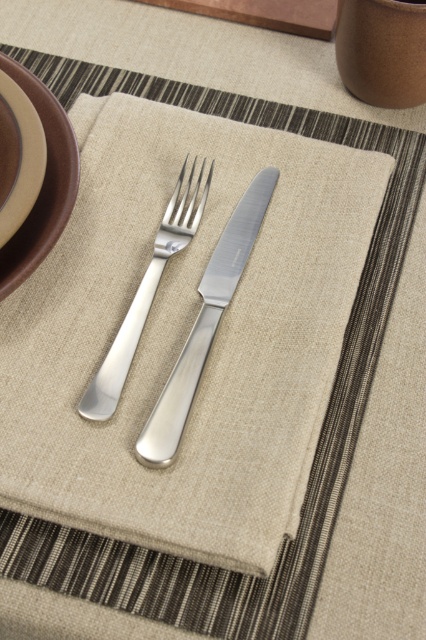
Question: Does polished silver knife at center appear over brown ceramic platter at upper left?

Choices:
 (A) no
 (B) yes

Answer: (A)

Question: Which is farther from the polished silver fork at center?

Choices:
 (A) polished silver knife at center
 (B) matte brown platter at left

Answer: (B)

Question: Does brown ceramic platter at upper left appear on the left side of matte brown platter at left?

Choices:
 (A) no
 (B) yes

Answer: (A)

Question: Which object is positioned farthest from the brown ceramic platter at upper left?

Choices:
 (A) polished silver knife at center
 (B) matte brown platter at left
 (C) polished silver fork at center

Answer: (A)

Question: Estimate the real-world distances between objects in this image. Which object is closer to the brown ceramic platter at upper left?

Choices:
 (A) polished silver fork at center
 (B) polished silver knife at center
 (C) matte brown platter at left

Answer: (C)

Question: Is polished silver fork at center bigger than matte brown platter at left?

Choices:
 (A) yes
 (B) no

Answer: (A)